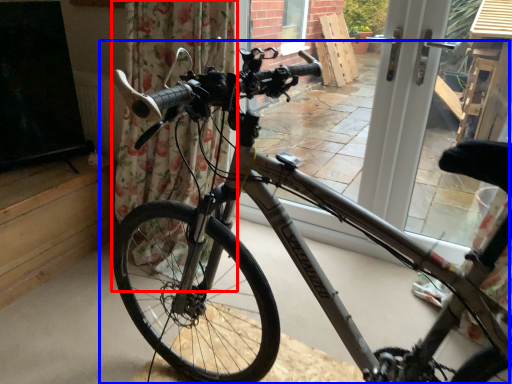
Question: Which object appears closest to the camera in this image, curtain (highlighted by a red box) or bicycle (highlighted by a blue box)?

Choices:
 (A) curtain
 (B) bicycle

Answer: (B)